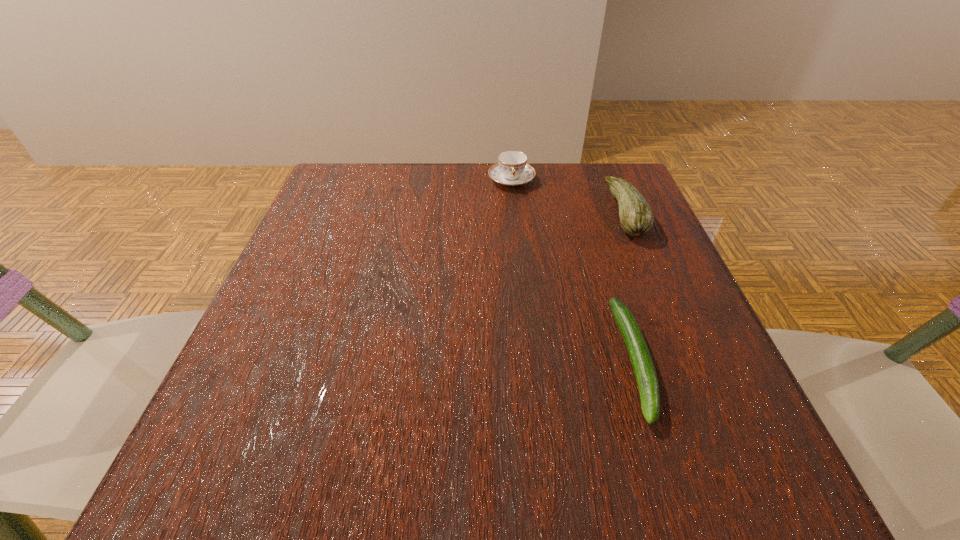
Identify which object is the nearest to the right zucchini. Please provide its 2D coordinates. Your answer should be formatted as a tuple, i.e. [(x, y)], where the tuple contains the x and y coordinates of a point satisfying the conditions above.

[(512, 169)]

This screenshot has height=540, width=960. Find the location of `the second closest object relative to the right zucchini`. the second closest object relative to the right zucchini is located at coordinates (640, 357).

Locate an element on the screen. Image resolution: width=960 pixels, height=540 pixels. free space that satisfies the following two spatial constraints: 1. at the stem end of the farther zucchini; 2. on the front-facing side of the left zucchini is located at coordinates (687, 360).

Find the location of a particular element. Image resolution: width=960 pixels, height=540 pixels. free spot that satisfies the following two spatial constraints: 1. at the stem end of the right zucchini; 2. on the front-facing side of the nearest object is located at coordinates (687, 360).

The height and width of the screenshot is (540, 960). I want to click on vacant space that satisfies the following two spatial constraints: 1. at the stem end of the rightmost object; 2. on the front-facing side of the left zucchini, so click(x=687, y=360).

Locate an element on the screen. Image resolution: width=960 pixels, height=540 pixels. vacant point that satisfies the following two spatial constraints: 1. at the stem end of the taller zucchini; 2. on the front-facing side of the nearer zucchini is located at coordinates (687, 360).